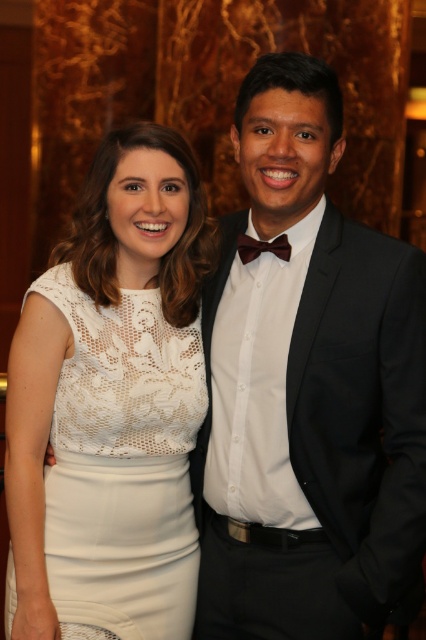
Question: Where is lace fabric dress at center located in relation to brown satin bow tie at center in the image?

Choices:
 (A) above
 (B) below

Answer: (B)

Question: Which of these objects is positioned farthest from the brown satin bow tie at center?

Choices:
 (A) black wool suit at right
 (B) lace fabric dress at center

Answer: (B)

Question: Can you confirm if lace fabric dress at center is positioned to the right of brown satin bow tie at center?

Choices:
 (A) yes
 (B) no

Answer: (B)

Question: Which object is farther from the camera taking this photo?

Choices:
 (A) brown satin bow tie at center
 (B) lace fabric dress at center

Answer: (A)

Question: Which of the following is the farthest from the observer?

Choices:
 (A) black wool suit at right
 (B) brown satin bow tie at center

Answer: (B)

Question: Is lace fabric dress at center to the right of black wool suit at right from the viewer's perspective?

Choices:
 (A) yes
 (B) no

Answer: (B)